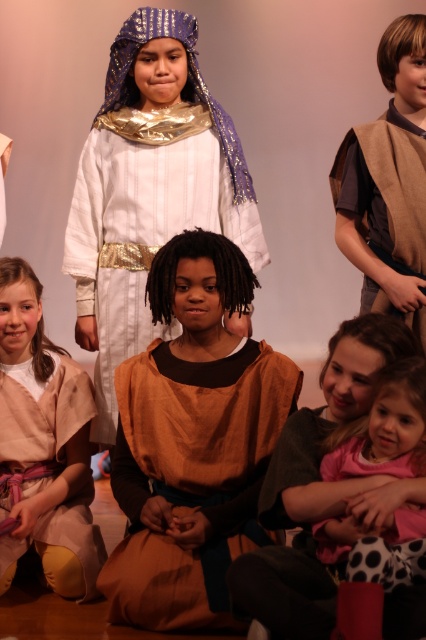
You are a photographer setting up for a photoshoot. You need to place a small light at the point marked by the coordinate point (388, 182). Which object in the scene should you position the light near?

The point at (388, 182) corresponds to the brown suede vest at upper right, so you should position the light near the brown suede vest at upper right.

In the scene shown: You are a photographer setting up for a photoshoot. You need to position a light to the right of the pink polka dot dress at lower right to highlight it. Will the white satin robe at center block the light from reaching the dress?

The white satin robe at center is to the left of the pink polka dot dress at lower right, so placing the light to the right of the dress would not be blocked by the robe. The light should reach the dress without obstruction.

You are a photographer setting up for a photoshoot. You need to place a small prop between the brown cotton dress at center and the brown suede vest at upper right so that it is equidistant from both. Where should you position the prop?

The prop should be placed midway between the brown cotton dress at center and the brown suede vest at upper right, ensuring equal distance from both objects.